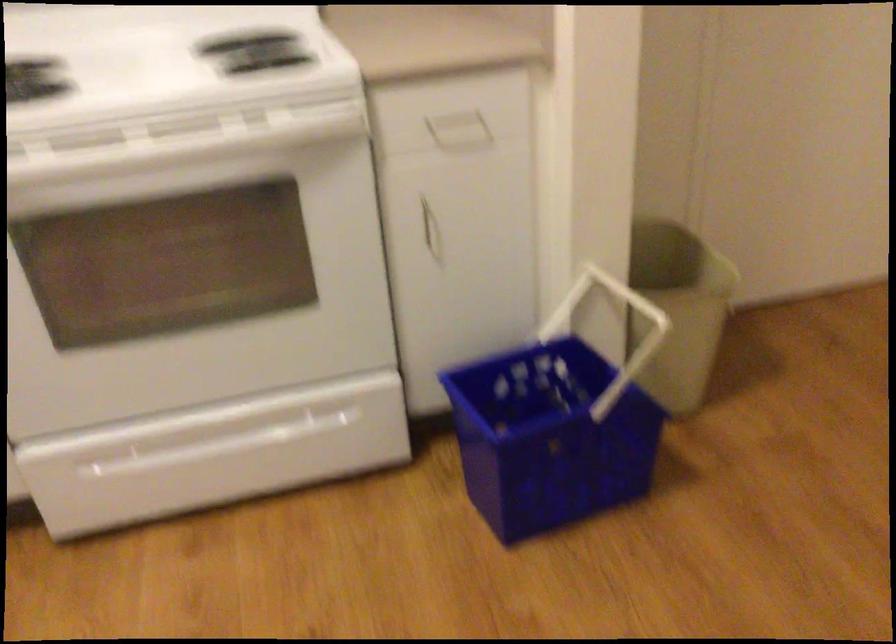
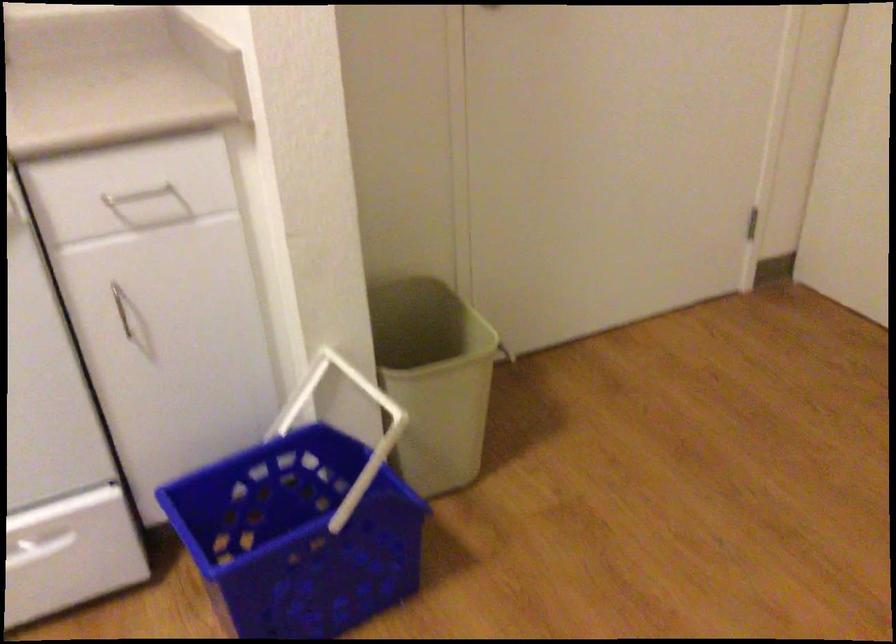
Locate, in the second image, the point that corresponds to point (677, 303) in the first image.

(434, 379)